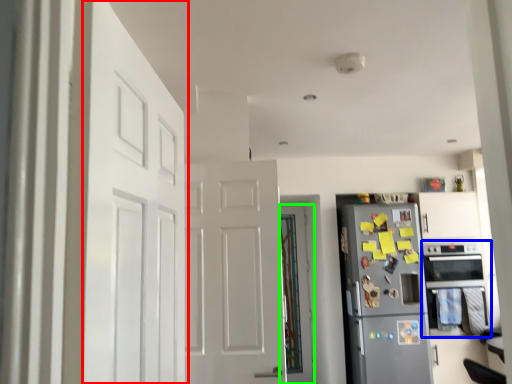
Question: Based on their relative distances, which object is farther from door (highlighted by a red box)? Choose from oven (highlighted by a blue box) and door (highlighted by a green box).

Choices:
 (A) oven
 (B) door

Answer: (A)